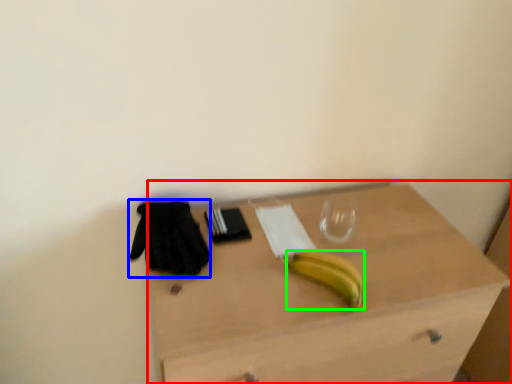
Question: Estimate the real-world distances between objects in this image. Which object is farther from desk (highlighted by a red box), glove (highlighted by a blue box) or banana (highlighted by a green box)?

Choices:
 (A) glove
 (B) banana

Answer: (A)